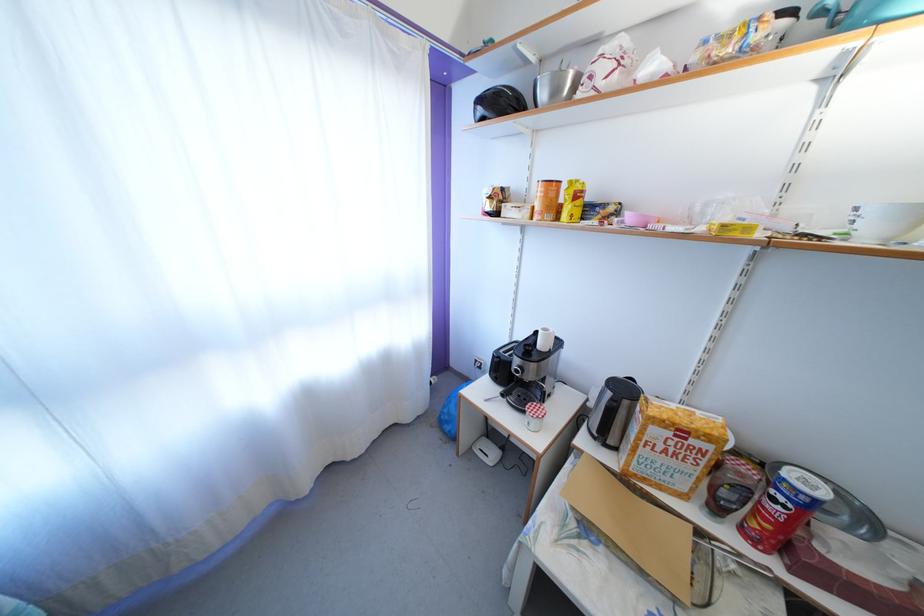
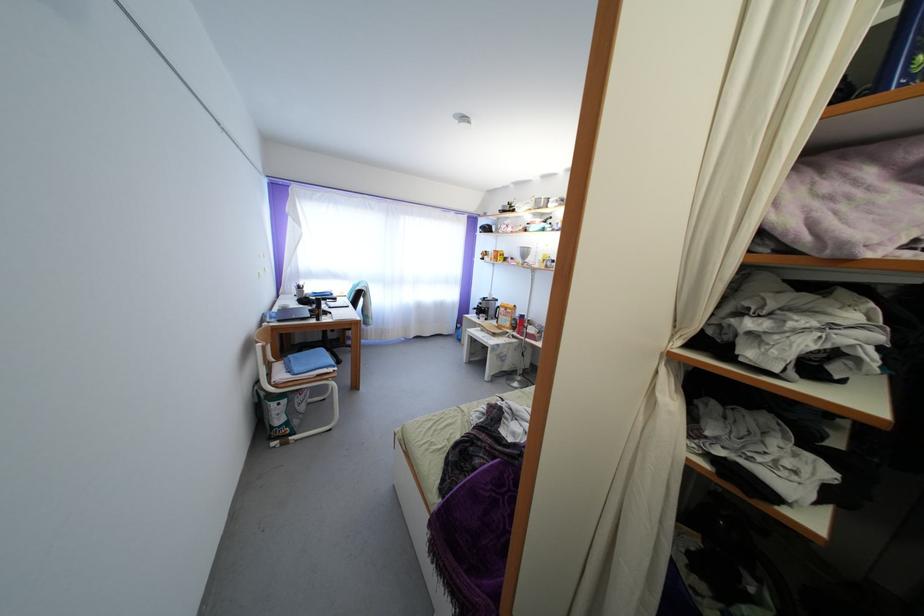
Which direction would the cameraman need to move to produce the second image?

The movement direction of the cameraman is right, backward.